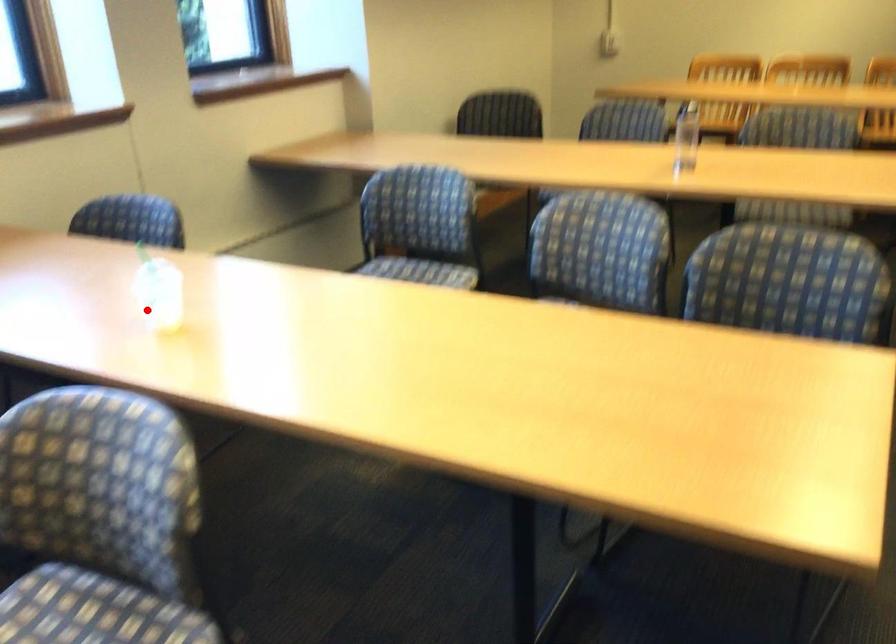
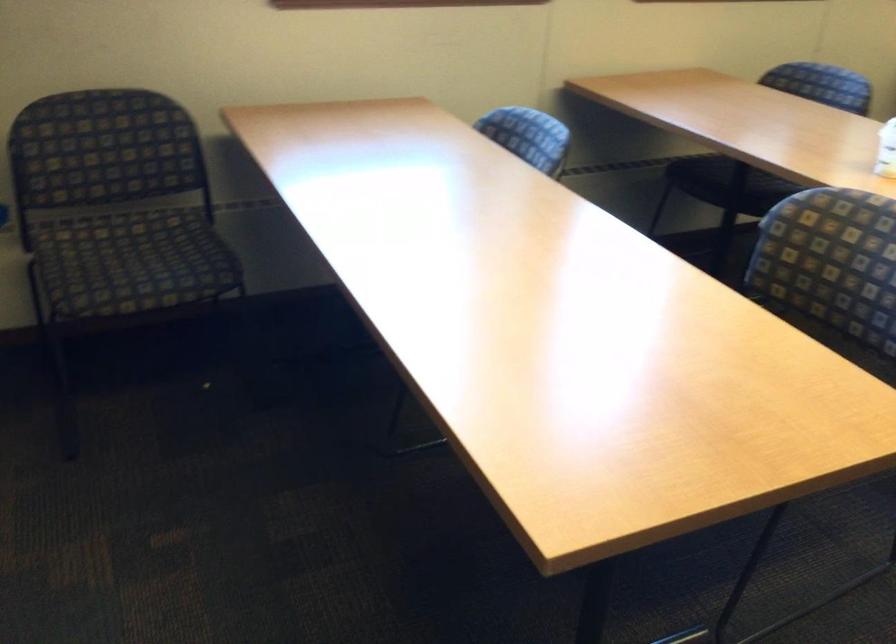
Question: A red point is marked in image1. In image2, is the corresponding 3D point closer to the camera or farther? Reply with the corresponding letter.

Choices:
 (A) The corresponding 3D point is closer.
 (B) The corresponding 3D point is farther.

Answer: (B)